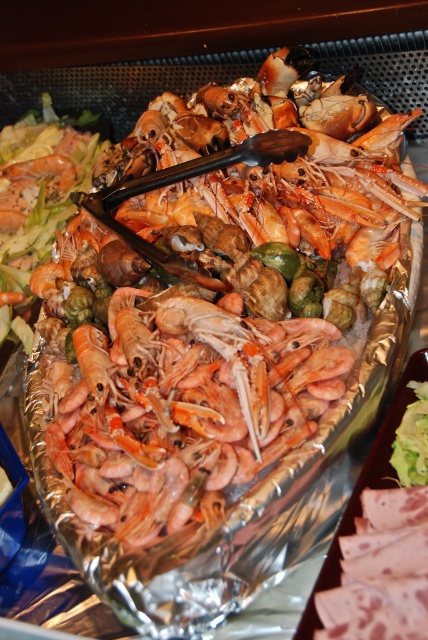
You are at a buffet and want to choose the taller shrimp between the orange matte shrimp at center and the pink matte shrimp at center. Which one should you pick?

The orange matte shrimp at center is taller than the pink matte shrimp at center, so you should pick the orange matte shrimp at center.

You are at a buffet and want to grab a shrimp from the platter. You see an orange matte shrimp at center and a pink matte shrimp at center. Which shrimp is positioned to the right side of the other?

The orange matte shrimp at center is positioned to the right of the pink matte shrimp at center.

You are at a buffet and want to grab a shrimp from the platter. The orange matte shrimp at center and the pink matte shrimp at center are both in your line of sight. Which shrimp is positioned higher up on the platter?

The orange matte shrimp at center is located above the pink matte shrimp at center, so it is positioned higher up on the platter.